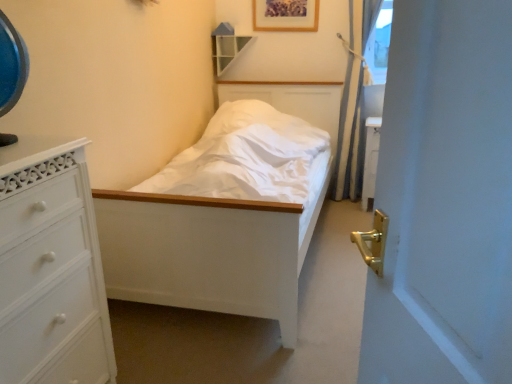
At what (x,y) coordinates should I click in order to perform the action: click on blank space above wooden shelf at upper center (from a real-world perspective). Please return your answer as a coordinate pair (x, y). This screenshot has width=512, height=384. Looking at the image, I should click on (234, 19).